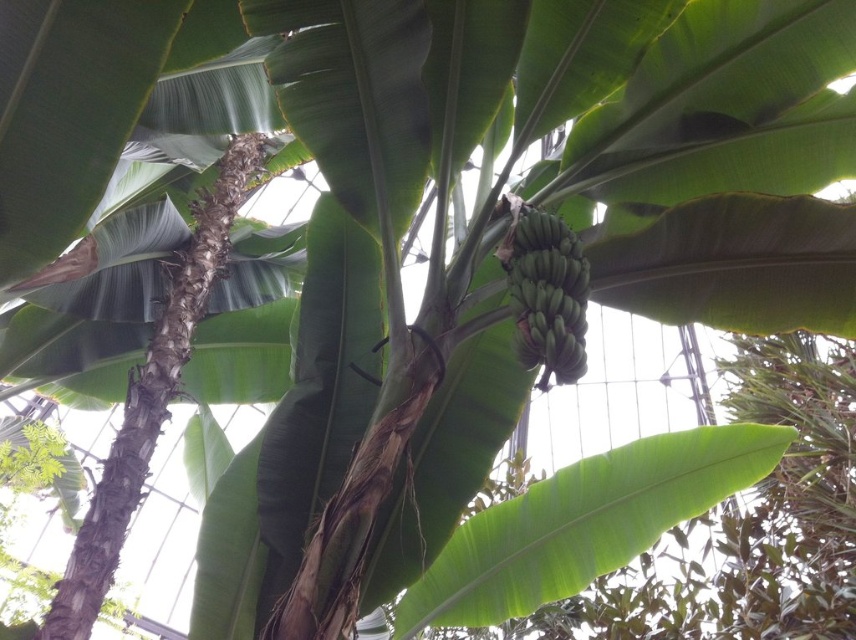
Question: Does green matte leaf at left lie behind green matte leaf at center?

Choices:
 (A) no
 (B) yes

Answer: (A)

Question: Which is nearer to the green matte leaf at left?

Choices:
 (A) green matte bananas at center
 (B) green smooth leaf at center
 (C) green matte leaf at center

Answer: (A)

Question: Which point is farther to the camera?

Choices:
 (A) (37, 241)
 (B) (810, 205)

Answer: (B)

Question: Is green matte leaf at left bigger than green matte bananas at center?

Choices:
 (A) no
 (B) yes

Answer: (B)

Question: Is green smooth leaf at center bigger than green matte bananas at center?

Choices:
 (A) no
 (B) yes

Answer: (B)

Question: Which point is closer to the camera taking this photo?

Choices:
 (A) (170, 19)
 (B) (476, 548)

Answer: (A)